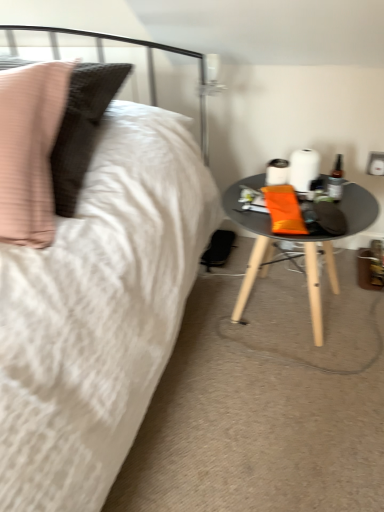
Find the location of a particular element. white glossy electric outlet at upper right is located at coordinates (375, 164).

What are the coordinates of `translucent glass bottle at right` in the screenshot? It's located at (336, 180).

The height and width of the screenshot is (512, 384). What do you see at coordinates (296, 240) in the screenshot? I see `matte black table at lower right` at bounding box center [296, 240].

The width and height of the screenshot is (384, 512). I want to click on white glossy electric outlet at upper right, so [x=375, y=164].

Can you confirm if white glossy electric outlet at upper right is smaller than translucent glass bottle at right?

Yes.

From the image's perspective, is white glossy electric outlet at upper right on top of translucent glass bottle at right?

Yes.

How different are the orientations of white glossy electric outlet at upper right and translucent glass bottle at right in degrees?

The angle between the facing direction of white glossy electric outlet at upper right and the facing direction of translucent glass bottle at right is 4.17 degrees.

From a real-world perspective, is white glossy electric outlet at upper right physically located above or below translucent glass bottle at right?

white glossy electric outlet at upper right is below translucent glass bottle at right.

From the picture: Is matte black table at lower right positioned with its back to translucent glass bottle at right?

Result: That's not correct — matte black table at lower right is not looking away from translucent glass bottle at right.

Considering the sizes of objects matte black table at lower right and translucent glass bottle at right in the image provided, who is thinner, matte black table at lower right or translucent glass bottle at right?

translucent glass bottle at right.

Which is further, (x=261, y=177) or (x=341, y=194)?

Point (x=261, y=177)

How many degrees apart are the facing directions of matte black table at lower right and translucent glass bottle at right?

4.17 degrees separate the facing orientations of matte black table at lower right and translucent glass bottle at right.

Is white glossy electric outlet at upper right surrounding matte black table at lower right?

No, white glossy electric outlet at upper right does not contain matte black table at lower right.

Considering their positions, is white glossy electric outlet at upper right located in front of or behind matte black table at lower right?

white glossy electric outlet at upper right is behind matte black table at lower right.

Which is in front, point (377, 158) or point (248, 261)?

The point (377, 158) is closer.

Between matte black table at lower right and white glossy electric outlet at upper right, which one has smaller width?

With smaller width is white glossy electric outlet at upper right.

Considering the sizes of objects matte black table at lower right and white glossy electric outlet at upper right in the image provided, who is smaller, matte black table at lower right or white glossy electric outlet at upper right?

white glossy electric outlet at upper right is smaller.

Consider the image. Considering the relative positions of matte black table at lower right and white glossy electric outlet at upper right in the image provided, is matte black table at lower right in front of white glossy electric outlet at upper right?

Yes, matte black table at lower right is closer to the viewer.

From the image's perspective, which is below, matte black table at lower right or white glossy electric outlet at upper right?

matte black table at lower right is shown below in the image.

Is the depth of translucent glass bottle at right less than that of matte black table at lower right?

No, translucent glass bottle at right is behind matte black table at lower right.

Is translucent glass bottle at right inside or outside of matte black table at lower right?

translucent glass bottle at right is not inside matte black table at lower right, it's outside.

Between translucent glass bottle at right and matte black table at lower right, which one has more height?

matte black table at lower right.

Looking at this image, could you tell me if translucent glass bottle at right is turned towards matte black table at lower right?

No.

From the image's perspective, who appears lower, translucent glass bottle at right or white glossy electric outlet at upper right?

From the image's view, translucent glass bottle at right is below.

Considering the sizes of translucent glass bottle at right and white glossy electric outlet at upper right in the image, is translucent glass bottle at right wider or thinner than white glossy electric outlet at upper right?

translucent glass bottle at right is wider than white glossy electric outlet at upper right.

Which object is positioned more to the left, translucent glass bottle at right or white glossy electric outlet at upper right?

From the viewer's perspective, translucent glass bottle at right appears more on the left side.

Is translucent glass bottle at right aimed at white glossy electric outlet at upper right?

No.

Find the location of `electric outlet above the translucent glass bottle at right (from the image's perspective)`. electric outlet above the translucent glass bottle at right (from the image's perspective) is located at coordinates (375, 164).

The width and height of the screenshot is (384, 512). Identify the location of bottle on the right of matte black table at lower right. (336, 180).

Looking at the image, which one is located further to matte black table at lower right, white glossy electric outlet at upper right or translucent glass bottle at right?

white glossy electric outlet at upper right is positioned further to the anchor matte black table at lower right.

Estimate the real-world distances between objects in this image. Which object is further from translucent glass bottle at right, white glossy electric outlet at upper right or matte black table at lower right?

matte black table at lower right lies further to translucent glass bottle at right than the other object.

Considering their positions, is translucent glass bottle at right positioned further to matte black table at lower right than white glossy electric outlet at upper right?

Based on the image, white glossy electric outlet at upper right appears to be further to matte black table at lower right.

Considering their positions, is matte black table at lower right positioned further to white glossy electric outlet at upper right than translucent glass bottle at right?

Based on the image, matte black table at lower right appears to be further to white glossy electric outlet at upper right.

From the image, which object appears to be nearer to translucent glass bottle at right, matte black table at lower right or white glossy electric outlet at upper right?

The object closer to translucent glass bottle at right is white glossy electric outlet at upper right.

Estimate the real-world distances between objects in this image. Which object is further from white glossy electric outlet at upper right, translucent glass bottle at right or matte black table at lower right?

matte black table at lower right is positioned further to the anchor white glossy electric outlet at upper right.

Locate an element on the screen. The image size is (384, 512). bottle between matte black table at lower right and white glossy electric outlet at upper right in the front-back direction is located at coordinates (336, 180).